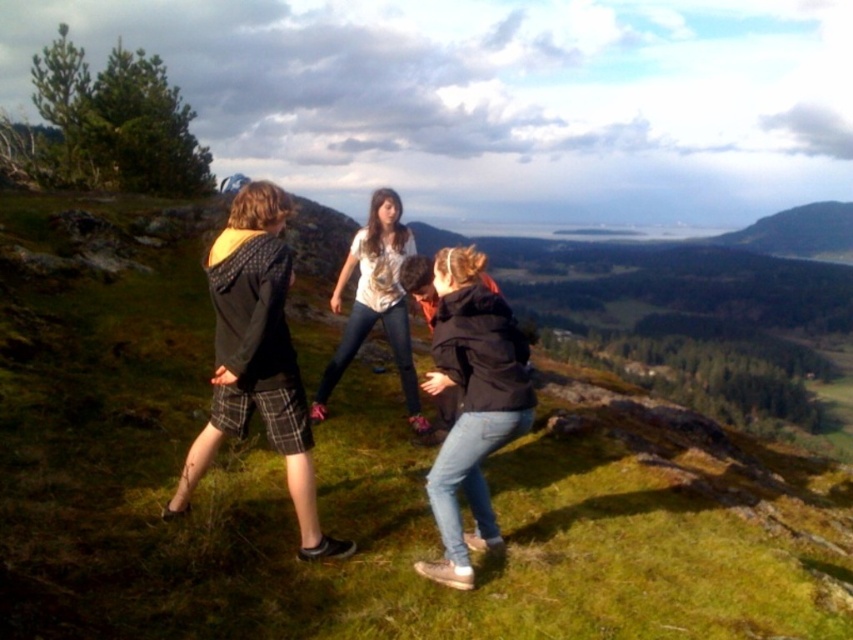
Can you confirm if plaid shorts at left is positioned to the right of white textured blouse at center?

Correct, you'll find plaid shorts at left to the right of white textured blouse at center.

Does plaid shorts at left have a lesser height compared to white textured blouse at center?

Yes, plaid shorts at left is shorter than white textured blouse at center.

This screenshot has width=853, height=640. Identify the location of plaid shorts at left. (257, 358).

Is green grassy at center taller than denim jeans at center?

Correct, green grassy at center is much taller as denim jeans at center.

This screenshot has height=640, width=853. In order to click on green grassy at center in this screenshot , I will do `click(358, 483)`.

Is denim jeans at center bigger than white textured blouse at center?

Actually, denim jeans at center might be smaller than white textured blouse at center.

Identify the location of denim jeans at center. (471, 404).

Find the location of a particular element. This screenshot has width=853, height=640. denim jeans at center is located at coordinates (471, 404).

Locate an element on the screen. This screenshot has height=640, width=853. denim jeans at center is located at coordinates (471, 404).